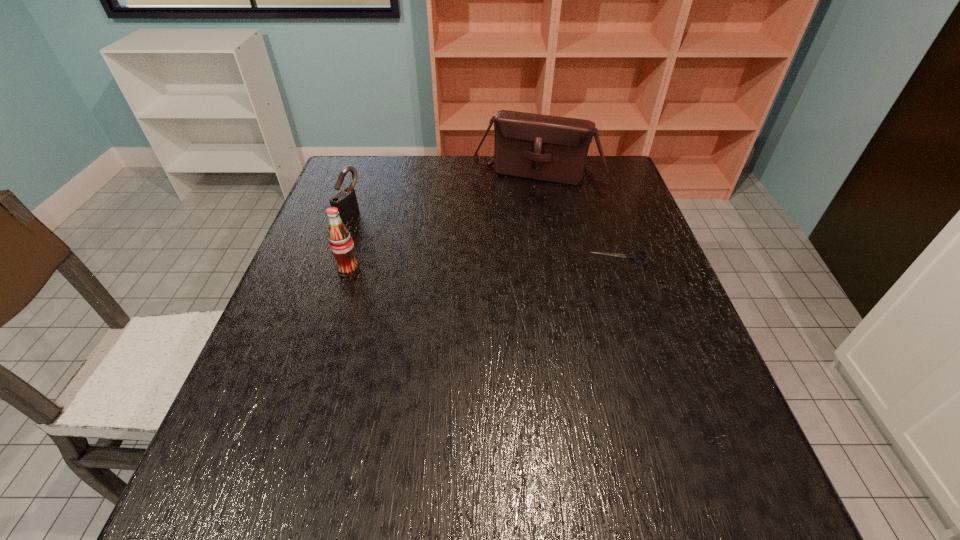
Identify the location of vacant area that lies between the soda and the farthest object. The image size is (960, 540). (443, 222).

You are a GUI agent. You are given a task and a screenshot of the screen. Output one action in this format:
    pyautogui.click(x=<x>, y=<y>)
    Task: Click on the vacant area that lies between the farthest object and the third tallest object
    This screenshot has height=540, width=960.
    Given the screenshot: What is the action you would take?
    pyautogui.click(x=444, y=194)

Identify which object is the second closest to the soda. Please provide its 2D coordinates. Your answer should be formatted as a tuple, i.e. [(x, y)], where the tuple contains the x and y coordinates of a point satisfying the conditions above.

[(549, 148)]

Select which object is the closest to the soda. Please provide its 2D coordinates. Your answer should be formatted as a tuple, i.e. [(x, y)], where the tuple contains the x and y coordinates of a point satisfying the conditions above.

[(345, 201)]

Locate an element on the screen. The height and width of the screenshot is (540, 960). vacant space that satisfies the following two spatial constraints: 1. on the front side of the farthest object; 2. on the right side of the shortest object is located at coordinates (552, 258).

The width and height of the screenshot is (960, 540). I want to click on free spot that satisfies the following two spatial constraints: 1. on the back side of the soda; 2. on the right side of the farthest object, so click(x=379, y=174).